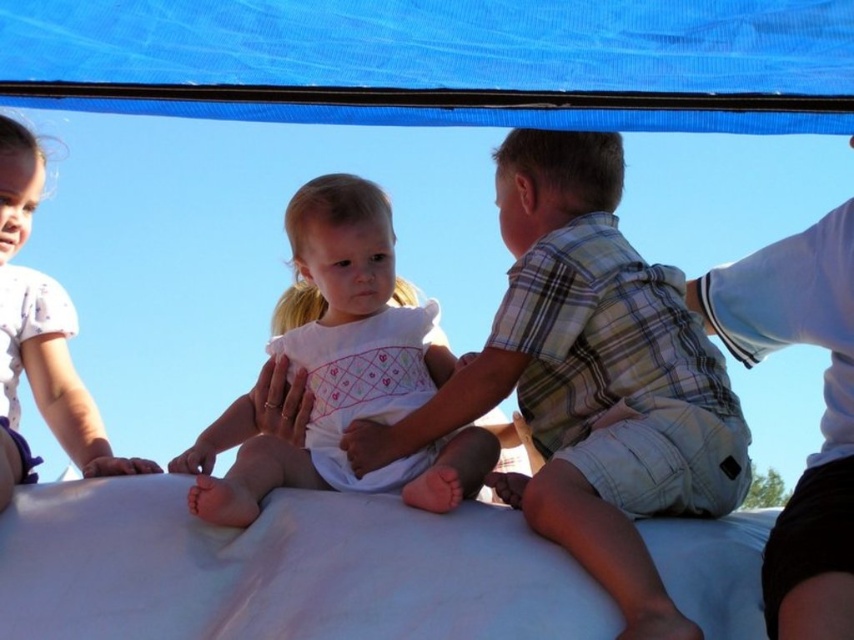
In the scene shown: You are a photographer trying to capture a group photo of the children under the blue tarp. Since the plaid cotton shirt at center and the white cotton dress at center are both in the frame, which clothing item should you focus on to ensure both are clearly visible in the photo?

The plaid cotton shirt at center is bigger than the white cotton dress at center, so focusing on the plaid cotton shirt at center will ensure both are clearly visible in the photo.

You are a photographer trying to capture a candid shot of the children under the blue tarp. You notice the plaid cotton shirt at center and the white cotton dress at center. Which child should you focus on first to ensure they are in sharp focus, considering their positions relative to you?

You should focus on the plaid cotton shirt at center first because it is closer to the viewer than the white cotton dress at center, ensuring it will be in sharp focus.

You are standing in the scene and want to locate the blue fabric canopy at upper center. What are the coordinates where you should look?

The blue fabric canopy at upper center is located at coordinates point [442,61].